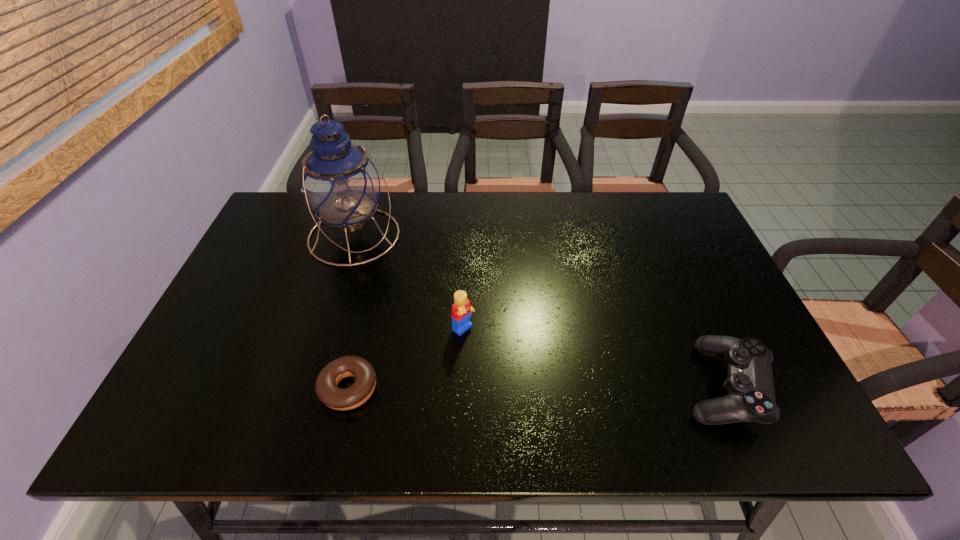
This screenshot has height=540, width=960. I want to click on vacant area located on the face of the Lego, so click(x=513, y=372).

The width and height of the screenshot is (960, 540). I want to click on vacant area situated on the face of the Lego, so click(x=533, y=388).

You are a GUI agent. You are given a task and a screenshot of the screen. Output one action in this format:
    pyautogui.click(x=<x>, y=<y>)
    Task: Click on the blank space located on the front-facing side of the farthest object
    This screenshot has width=960, height=540.
    Given the screenshot: What is the action you would take?
    pyautogui.click(x=449, y=345)

I want to click on vacant area situated 0.180m on the front-facing side of the farthest object, so click(408, 298).

Locate an element on the screen. Image resolution: width=960 pixels, height=540 pixels. vacant space located 0.290m on the front-facing side of the farthest object is located at coordinates (431, 324).

This screenshot has width=960, height=540. In order to click on object that is at the far edge in this screenshot , I will do `click(339, 183)`.

Locate an element on the screen. This screenshot has width=960, height=540. doughnut that is at the near edge is located at coordinates (326, 387).

At what (x,y) coordinates should I click in order to perform the action: click on control at the near edge. Please return your answer as a coordinate pair (x, y). The width and height of the screenshot is (960, 540). Looking at the image, I should click on (750, 386).

Find the location of a particular element. The width and height of the screenshot is (960, 540). object that is at the left edge is located at coordinates (339, 183).

You are a GUI agent. You are given a task and a screenshot of the screen. Output one action in this format:
    pyautogui.click(x=<x>, y=<y>)
    Task: Click on the object that is at the right edge
    
    Given the screenshot: What is the action you would take?
    pyautogui.click(x=750, y=386)